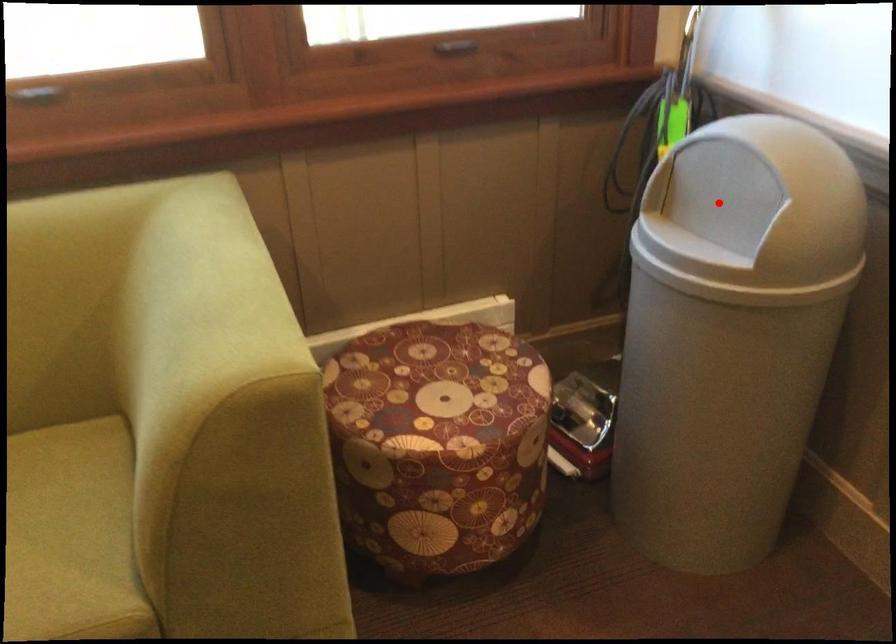
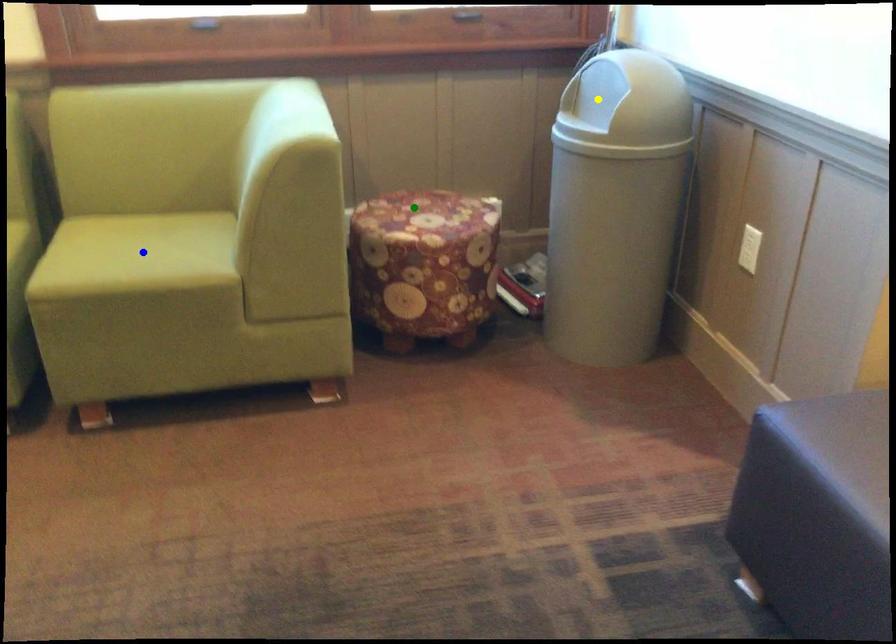
Question: I am providing you with two images of the same scene from different viewpoints. A red point is marked on the first image. You are given multiple points on the second image. Can you choose the point in image 2 that corresponds to the point in image 1?

Choices:
 (A) blue point
 (B) yellow point
 (C) green point

Answer: (B)